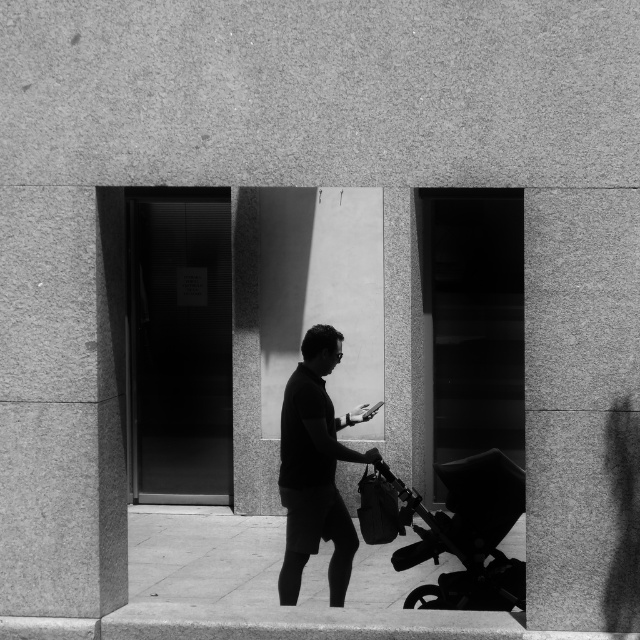
Question: Does smooth concrete pavement at center have a greater width compared to dark gray fabric shirt at center?

Choices:
 (A) yes
 (B) no

Answer: (A)

Question: Does smooth concrete pavement at center appear on the left side of dark gray fabric shirt at center?

Choices:
 (A) no
 (B) yes

Answer: (B)

Question: Considering the relative positions of smooth concrete pavement at center and dark gray fabric shirt at center in the image provided, where is smooth concrete pavement at center located with respect to dark gray fabric shirt at center?

Choices:
 (A) below
 (B) above

Answer: (A)

Question: Which point is farther from the camera taking this photo?

Choices:
 (A) (513, 516)
 (B) (200, 624)

Answer: (A)

Question: Which is nearer to the dark gray fabric shirt at center?

Choices:
 (A) black plastic baby carriage at lower right
 (B) smooth concrete pavement at center

Answer: (A)

Question: Based on their relative distances, which object is farther from the dark gray fabric shirt at center?

Choices:
 (A) black plastic baby carriage at lower right
 (B) smooth concrete pavement at center

Answer: (B)